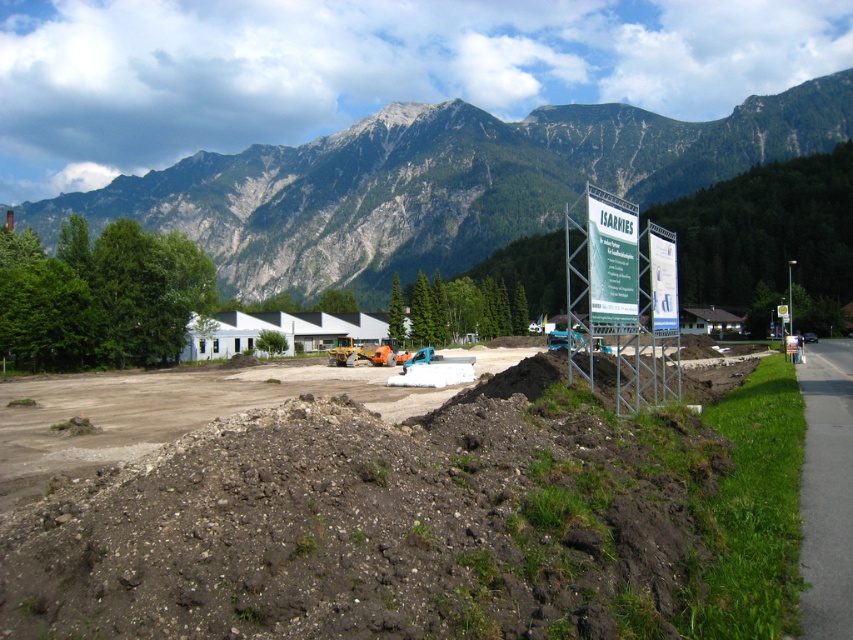
Does brown soil at center appear on the left side of rocky gray mountain at upper center?

No, brown soil at center is not to the left of rocky gray mountain at upper center.

In the scene shown: Who is higher up, brown soil at center or rocky gray mountain at upper center?

rocky gray mountain at upper center is higher up.

The image size is (853, 640). I want to click on brown soil at center, so click(379, 524).